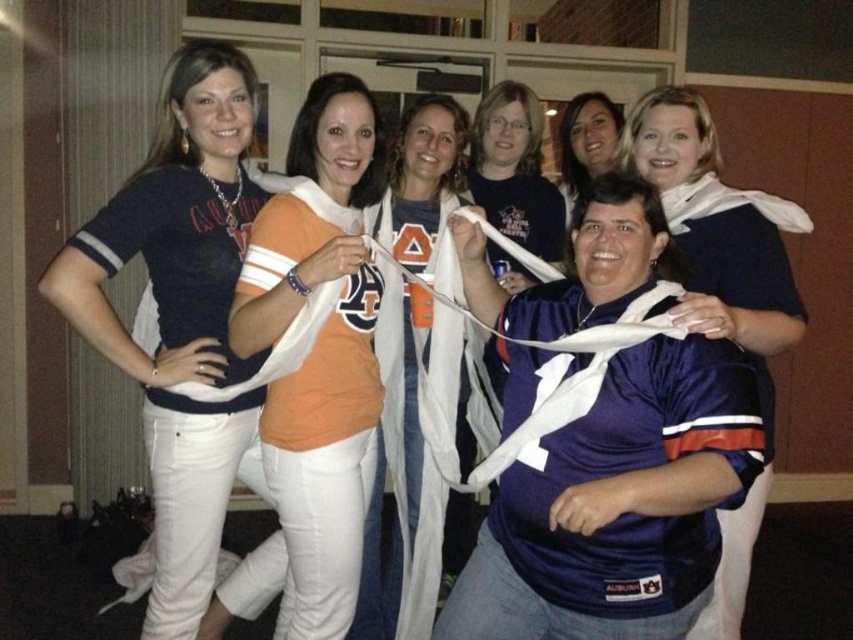
Consider the image. You are a photographer at the event and want to ensure everyone is visible in the group photo. The matte black shirt at upper left and the satin blue jersey at center are in your frame. Which person should you ask to crouch slightly so that their head is visible in the photo?

→ The matte black shirt at upper left is much taller than the satin blue jersey at center, so you should ask the person wearing the matte black shirt at upper left to crouch slightly so their head remains visible in the photo.

You are at a sports event and need to determine which jersey is taller between the purple satin jersey at center and the orange jersey at center. Based on the scene, can you tell which one is shorter?

The purple satin jersey at center is not as tall as orange jersey at center, so the purple satin jersey at center is shorter.